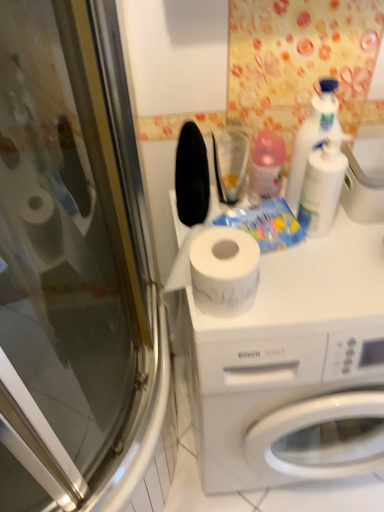
Question: Considering the relative sizes of pink plastic bottle at upper center, the third cleaning product when ordered from right to left, and white plastic bottle at upper right, the second cleaning product viewed from the left, in the image provided, is pink plastic bottle at upper center, the third cleaning product when ordered from right to left, shorter than white plastic bottle at upper right, the second cleaning product viewed from the left,?

Choices:
 (A) no
 (B) yes

Answer: (B)

Question: Can you confirm if pink plastic bottle at upper center, the third cleaning product when ordered from right to left, is smaller than white plastic bottle at upper right, which appears as the 2th cleaning product when viewed from the right?

Choices:
 (A) yes
 (B) no

Answer: (B)

Question: Considering the relative sizes of pink plastic bottle at upper center, marked as the first cleaning product in a left-to-right arrangement, and white plastic bottle at upper right, the second cleaning product viewed from the left, in the image provided, is pink plastic bottle at upper center, marked as the first cleaning product in a left-to-right arrangement, taller than white plastic bottle at upper right, the second cleaning product viewed from the left,?

Choices:
 (A) no
 (B) yes

Answer: (A)

Question: Could you tell me if pink plastic bottle at upper center, marked as the first cleaning product in a left-to-right arrangement, is turned towards white plastic bottle at upper right, which appears as the 2th cleaning product when viewed from the right?

Choices:
 (A) no
 (B) yes

Answer: (A)

Question: Can you confirm if pink plastic bottle at upper center, marked as the first cleaning product in a left-to-right arrangement, is positioned to the left of white plastic bottle at upper right, the second cleaning product viewed from the left?

Choices:
 (A) no
 (B) yes

Answer: (B)

Question: Is there a large distance between pink plastic bottle at upper center, marked as the first cleaning product in a left-to-right arrangement, and white plastic bottle at upper right, which appears as the 2th cleaning product when viewed from the right?

Choices:
 (A) no
 (B) yes

Answer: (A)

Question: Considering the relative sizes of transparent glass screen door at left and white plastic bottle at upper right, the second cleaning product viewed from the left, in the image provided, is transparent glass screen door at left wider than white plastic bottle at upper right, the second cleaning product viewed from the left,?

Choices:
 (A) yes
 (B) no

Answer: (A)

Question: From a real-world perspective, is transparent glass screen door at left on white plastic bottle at upper right, the second cleaning product viewed from the left?

Choices:
 (A) no
 (B) yes

Answer: (A)

Question: Can you confirm if transparent glass screen door at left is thinner than white plastic bottle at upper right, the second cleaning product viewed from the left?

Choices:
 (A) no
 (B) yes

Answer: (A)

Question: Considering the relative positions of transparent glass screen door at left and white plastic bottle at upper right, the second cleaning product viewed from the left, in the image provided, is transparent glass screen door at left behind white plastic bottle at upper right, the second cleaning product viewed from the left,?

Choices:
 (A) no
 (B) yes

Answer: (A)

Question: Are transparent glass screen door at left and white plastic bottle at upper right, which appears as the 2th cleaning product when viewed from the right, far apart?

Choices:
 (A) no
 (B) yes

Answer: (A)

Question: Could you tell me if transparent glass screen door at left is facing white plastic bottle at upper right, which appears as the 2th cleaning product when viewed from the right?

Choices:
 (A) no
 (B) yes

Answer: (B)

Question: Is white plastic bottle at upper right, which is the 3th cleaning product in left-to-right order, further to the viewer compared to white matte washing machine at center?

Choices:
 (A) no
 (B) yes

Answer: (B)